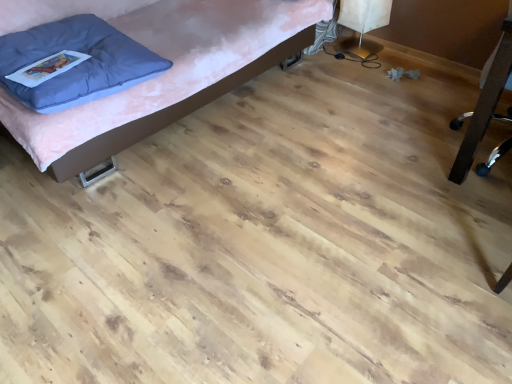
Question: From a real-world perspective, is blue soft pillow at upper left beneath matte pink bed at upper left, which ranks as the 1th furniture in left-to-right order?

Choices:
 (A) no
 (B) yes

Answer: (A)

Question: Does blue soft pillow at upper left have a lesser width compared to matte pink bed at upper left, which is the second furniture in right-to-left order?

Choices:
 (A) no
 (B) yes

Answer: (B)

Question: Is blue soft pillow at upper left positioned far away from matte pink bed at upper left, which is the second furniture in right-to-left order?

Choices:
 (A) no
 (B) yes

Answer: (A)

Question: Is blue soft pillow at upper left at the right side of matte pink bed at upper left, which is the second furniture in right-to-left order?

Choices:
 (A) yes
 (B) no

Answer: (B)

Question: Is blue soft pillow at upper left facing towards matte pink bed at upper left, which is the second furniture in right-to-left order?

Choices:
 (A) no
 (B) yes

Answer: (B)

Question: From their relative heights in the image, would you say matte pink bed at upper left, which is the second furniture in right-to-left order, is taller or shorter than blue soft pillow at upper left?

Choices:
 (A) short
 (B) tall

Answer: (B)

Question: From the image's perspective, is matte pink bed at upper left, which ranks as the 1th furniture in left-to-right order, positioned above or below blue soft pillow at upper left?

Choices:
 (A) above
 (B) below

Answer: (A)

Question: Relative to blue soft pillow at upper left, is matte pink bed at upper left, which ranks as the 1th furniture in left-to-right order, in front or behind?

Choices:
 (A) front
 (B) behind

Answer: (A)

Question: Considering the positions of point (239, 57) and point (93, 62), is point (239, 57) closer or farther from the camera than point (93, 62)?

Choices:
 (A) farther
 (B) closer

Answer: (A)

Question: From a real-world perspective, is blue soft pillow at upper left above or below black plastic chair at right, the 2th furniture viewed from the left?

Choices:
 (A) above
 (B) below

Answer: (A)

Question: Is blue soft pillow at upper left in front of or behind black plastic chair at right, which ranks as the first furniture in right-to-left order, in the image?

Choices:
 (A) behind
 (B) front

Answer: (A)

Question: Is blue soft pillow at upper left taller or shorter than black plastic chair at right, the 2th furniture viewed from the left?

Choices:
 (A) tall
 (B) short

Answer: (B)

Question: Is blue soft pillow at upper left inside the boundaries of black plastic chair at right, which ranks as the first furniture in right-to-left order, or outside?

Choices:
 (A) outside
 (B) inside

Answer: (A)

Question: Looking at their shapes, would you say black plastic chair at right, which ranks as the first furniture in right-to-left order, is wider or thinner than blue soft pillow at upper left?

Choices:
 (A) thin
 (B) wide

Answer: (B)

Question: Considering the positions of black plastic chair at right, which ranks as the first furniture in right-to-left order, and blue soft pillow at upper left in the image, is black plastic chair at right, which ranks as the first furniture in right-to-left order, bigger or smaller than blue soft pillow at upper left?

Choices:
 (A) small
 (B) big

Answer: (B)